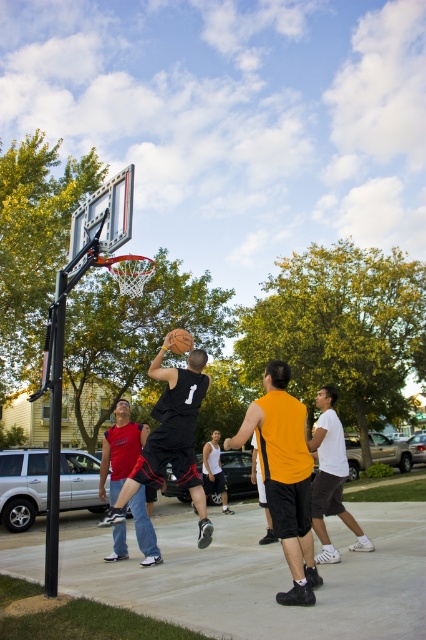
Question: Which of the following is the farthest from the observer?

Choices:
 (A) (175, 456)
 (B) (224, 490)
 (C) (170, 349)

Answer: (B)

Question: Can you confirm if black matte basketball at center is thinner than white tank top at center?

Choices:
 (A) no
 (B) yes

Answer: (A)

Question: Estimate the real-world distances between objects in this image. Which object is farther from the rubber textured basketball at center?

Choices:
 (A) red fabric shirt at center
 (B) matte black basketball at center

Answer: (A)

Question: Where is red fabric shirt at center located in relation to white tank top at center in the image?

Choices:
 (A) below
 (B) above

Answer: (B)

Question: From the image, what is the correct spatial relationship of red fabric shirt at center in relation to white tank top at center?

Choices:
 (A) right
 (B) left

Answer: (B)

Question: Which point is closer to the camera?

Choices:
 (A) (236, 442)
 (B) (242, 440)
 (C) (111, 556)
 (D) (328, 392)

Answer: (B)